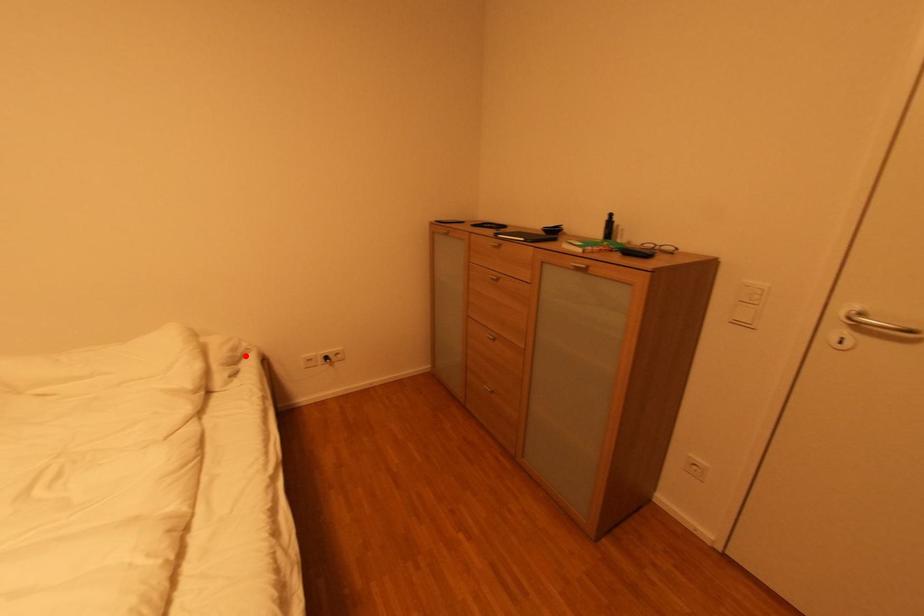
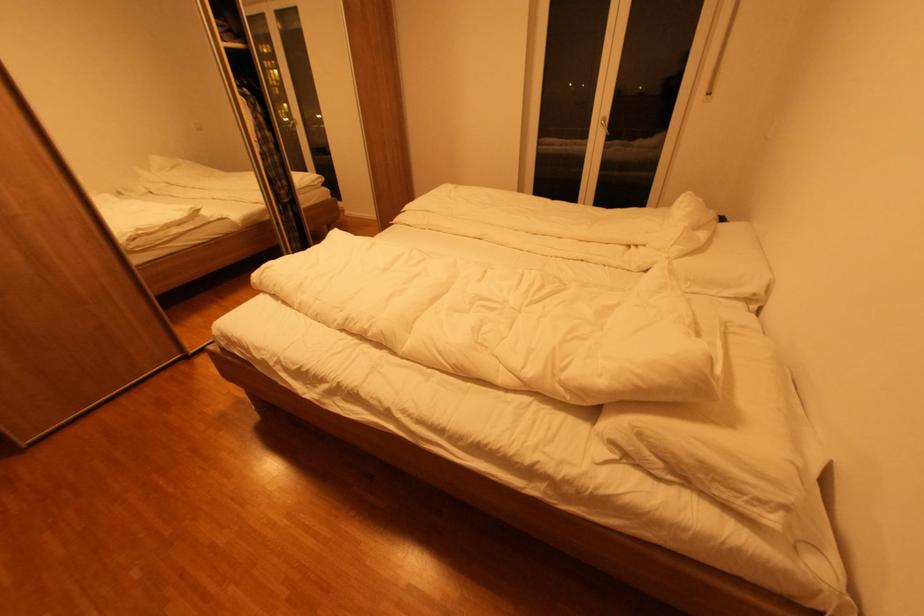
Where in the second image is the point corresponding to the highlighted location from the first image?

(723, 495)